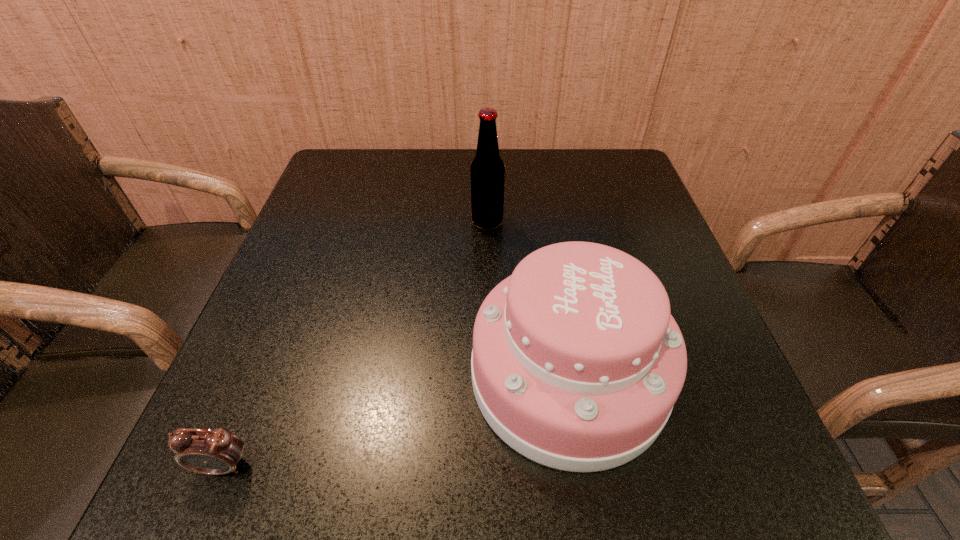
Identify the location of object present at the right edge. This screenshot has height=540, width=960. (577, 362).

Image resolution: width=960 pixels, height=540 pixels. What are the coordinates of `object located in the near left corner section of the desktop` in the screenshot? It's located at (208, 451).

I want to click on object located at the near right corner, so click(577, 362).

Where is `free space at the far edge of the desktop`? This screenshot has height=540, width=960. free space at the far edge of the desktop is located at coordinates (396, 197).

The width and height of the screenshot is (960, 540). Find the location of `vacant space at the near edge`. vacant space at the near edge is located at coordinates (570, 480).

At what (x,y) coordinates should I click in order to perform the action: click on free space at the left edge of the desktop. Please return your answer as a coordinate pair (x, y). Looking at the image, I should click on (315, 245).

In the image, there is a desktop. Identify the location of vacant space at the right edge. (616, 244).

Find the location of a particular element. The width and height of the screenshot is (960, 540). vacant space at the near left corner of the desktop is located at coordinates (276, 492).

In order to click on vacant area at the near right corner in this screenshot , I will do `click(761, 503)`.

You are a GUI agent. You are given a task and a screenshot of the screen. Output one action in this format:
    pyautogui.click(x=<x>, y=<y>)
    Task: Click on the vacant space that's between the beer bottle and the shortest object
    This screenshot has height=540, width=960.
    Given the screenshot: What is the action you would take?
    pyautogui.click(x=355, y=343)